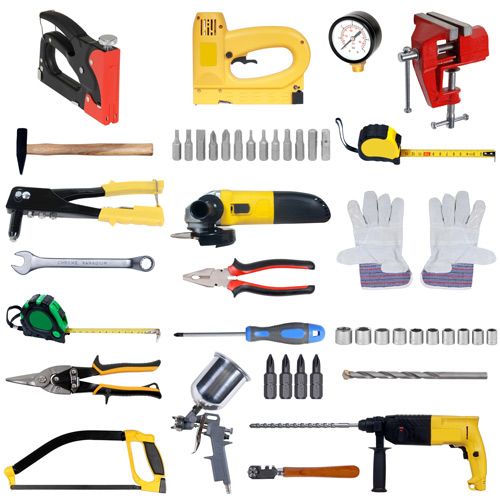
This screenshot has height=500, width=500. Find the location of `sockets`. sockets is located at coordinates click(340, 334), click(363, 335), click(380, 336), click(405, 340), click(417, 336), click(433, 335), click(446, 337), click(470, 337), click(480, 338), click(488, 336).